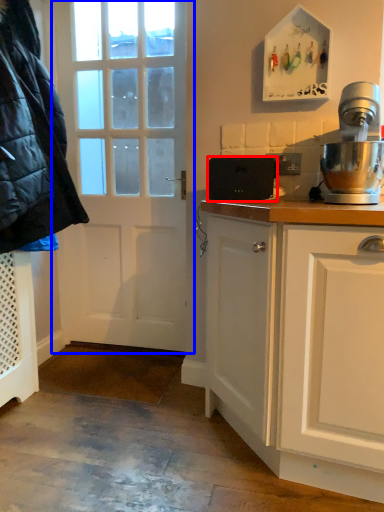
Question: Which of the following is the farthest to the observer, appliance (highlighted by a red box) or door (highlighted by a blue box)?

Choices:
 (A) appliance
 (B) door

Answer: (B)